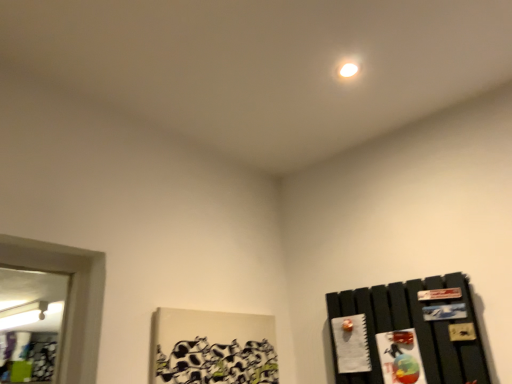
Describe the element at coordinates (218, 363) in the screenshot. The height and width of the screenshot is (384, 512). I see `black and white abstract painting at lower center` at that location.

Identify the location of black and white abstract painting at lower center. (218, 363).

Find the location of a particular element. black and white abstract painting at lower center is located at coordinates (218, 363).